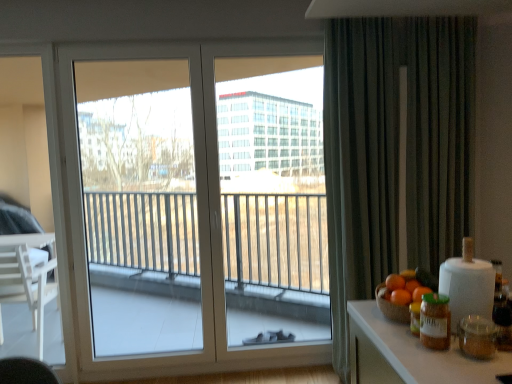
Question: Is green matte jar at right inside or outside of orange matte at right, acting as the second orange starting from the back?

Choices:
 (A) inside
 (B) outside

Answer: (B)

Question: From a real-world perspective, relative to orange matte at right, acting as the second orange starting from the back, is green matte jar at right vertically above or below?

Choices:
 (A) below
 (B) above

Answer: (A)

Question: Which object is the farthest from the orange matte at right, marked as the third orange in a back-to-front arrangement?

Choices:
 (A) orange matte at right, the 2th orange in the front-to-back sequence
 (B) white glass window at center
 (C) orange matte at right, the 3th orange positioned from the front
 (D) green matte jar at right
 (E) dark grey textured curtain at right

Answer: (B)

Question: Estimate the real-world distances between objects in this image. Which object is farther from the orange matte at right, the 2th orange in the front-to-back sequence?

Choices:
 (A) dark grey textured curtain at right
 (B) white glass window at center
 (C) transparent glass window at left
 (D) orange matte at right, positioned as the 1th orange in back-to-front order
 (E) green matte jar at right

Answer: (C)